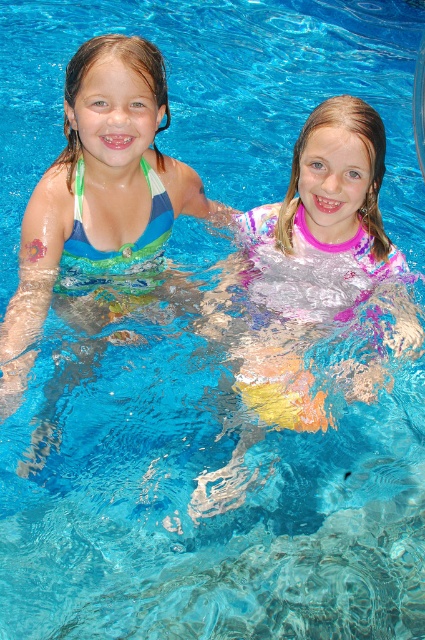
You are designing a new swimsuit collection and want to include both the multicolored fabric swimsuit at center and the matte blue swimsuit at left. Based on their sizes, which swimsuit would require more fabric to produce?

The matte blue swimsuit at left requires more fabric because it occupies more space than the multicolored fabric swimsuit at center.

Where is the multicolored fabric swimsuit at center located in the image?

The multicolored fabric swimsuit at center is located at point (314,253).

You are a photographer trying to capture a closeup shot of the girl at point (x=226, y=316) and the girl at point (x=209, y=211). Which girl will appear larger in your photo?

The girl at point (x=226, y=316) will appear larger in the photo because she is closer to the viewer than the girl at point (x=209, y=211).